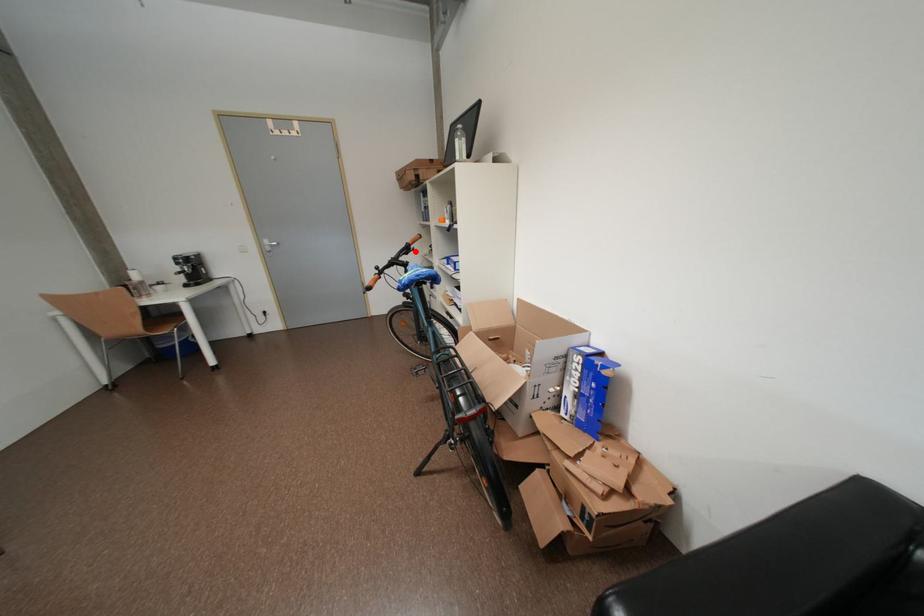
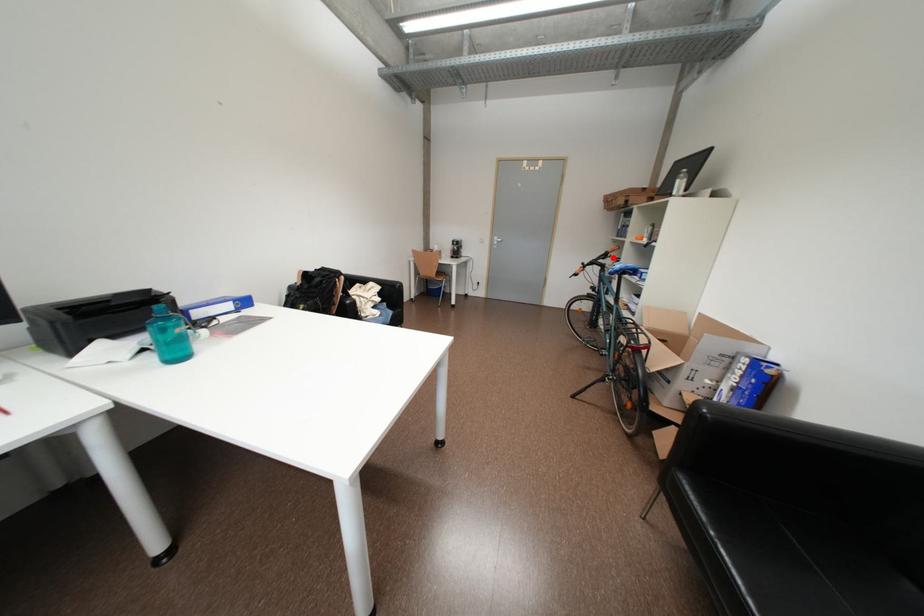
I am providing you with two images of the same scene from different viewpoints. A red point is marked on the first image and another point is marked on the second image. Are the points marked in image1 and image2 representing the same 3D position?

Yes